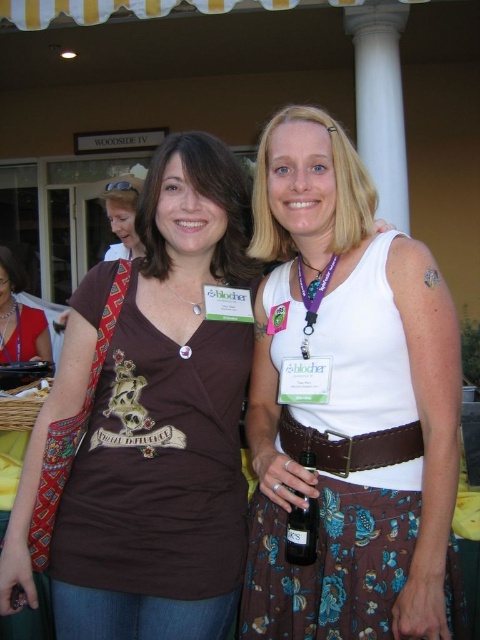
Question: Which object is positioned farthest from the brown leather belt at center?

Choices:
 (A) translucent glass bottle at center
 (B) purple fabric lanyard at center
 (C) matte black laptop at left

Answer: (C)

Question: Which of these objects is positioned farthest from the brown fabric shirt at center?

Choices:
 (A) brown leather belt at center
 (B) purple fabric lanyard at center

Answer: (B)

Question: Considering the relative positions of brown leather belt at center and matte black laptop at left in the image provided, where is brown leather belt at center located with respect to matte black laptop at left?

Choices:
 (A) above
 (B) below

Answer: (B)

Question: Is translucent glass bottle at center thinner than purple fabric lanyard at center?

Choices:
 (A) yes
 (B) no

Answer: (A)

Question: Can you confirm if white matte tank top at center is positioned to the left of translucent glass bottle at center?

Choices:
 (A) no
 (B) yes

Answer: (A)

Question: Based on their relative distances, which object is nearer to the translucent glass bottle at center?

Choices:
 (A) matte black laptop at left
 (B) brown leather belt at center

Answer: (B)